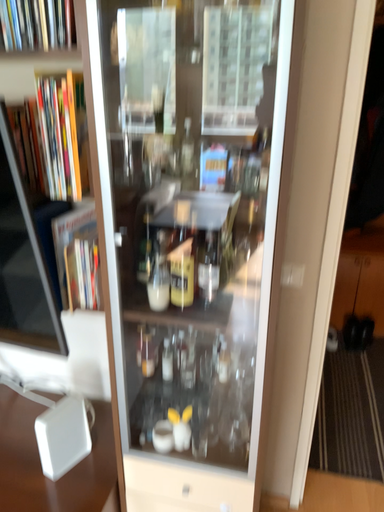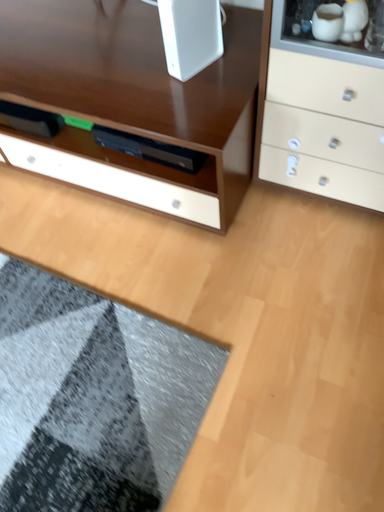
Question: How did the camera likely rotate when shooting the video?

Choices:
 (A) rotated downward
 (B) rotated upward

Answer: (A)